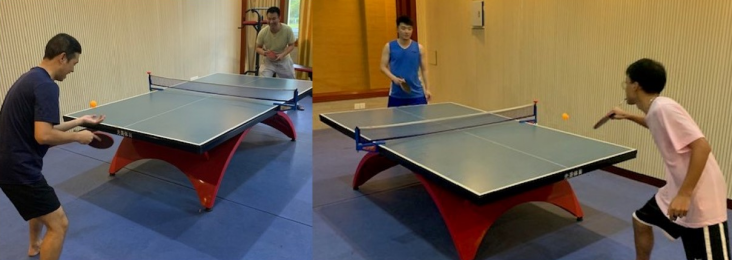
Image resolution: width=732 pixels, height=260 pixels. What are the coordinates of `pingpong table` in the screenshot? It's located at (227, 105), (452, 138).